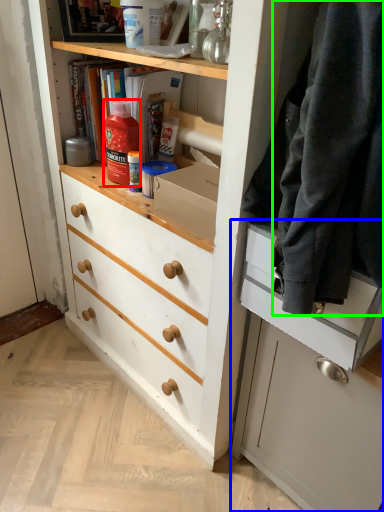
Question: Considering the real-world distances, which object is closest to bottle (highlighted by a red box)? cabinetry (highlighted by a blue box) or clothing (highlighted by a green box).

Choices:
 (A) cabinetry
 (B) clothing

Answer: (B)